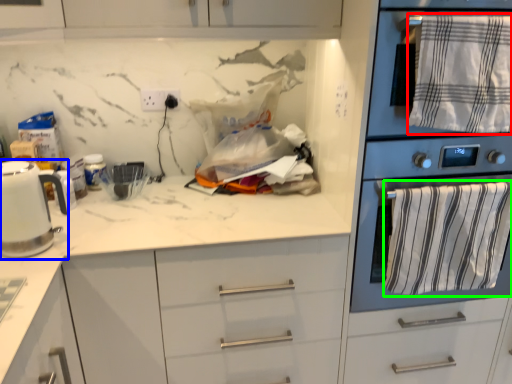
Question: Which object is positioned closest to bath towel (highlighted by a red box)? Select from kitchen appliance (highlighted by a blue box) and bath towel (highlighted by a green box).

Choices:
 (A) kitchen appliance
 (B) bath towel

Answer: (B)